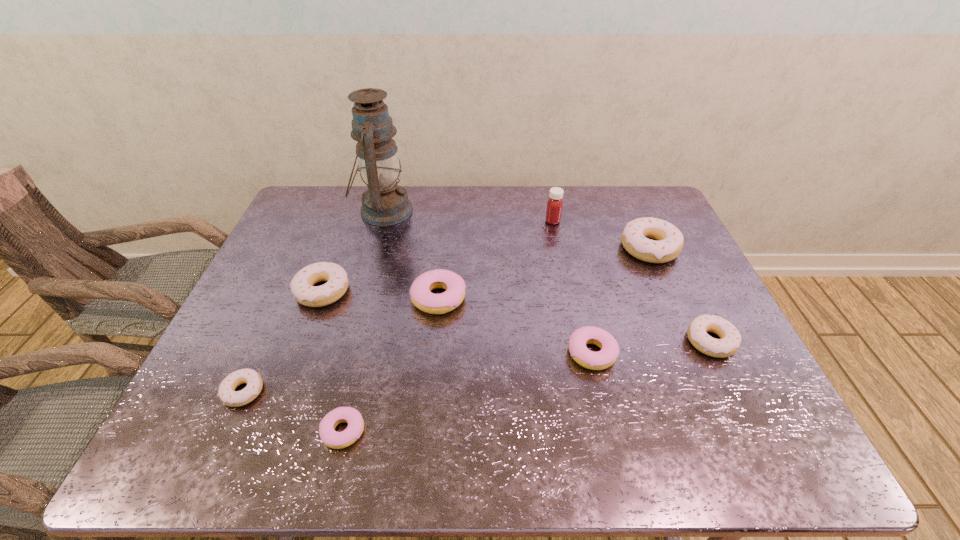
Locate an element on the screen. vacant space at the right edge is located at coordinates (747, 361).

Where is `vacant point at the far left corner`? This screenshot has width=960, height=540. vacant point at the far left corner is located at coordinates (302, 200).

The image size is (960, 540). In the image, there is a desktop. What are the coordinates of `free space at the far right corner` in the screenshot? It's located at (638, 186).

Image resolution: width=960 pixels, height=540 pixels. Identify the location of vacant space at the near right corner of the desktop. (728, 454).

Locate an element on the screen. This screenshot has width=960, height=540. free point between the biggest white doughnut and the farthest pink doughnut is located at coordinates (544, 273).

Locate an element on the screen. empty location between the nearest white doughnut and the third farthest white doughnut is located at coordinates (477, 366).

The image size is (960, 540). Identify the location of free space between the tallest object and the second smallest white doughnut. (547, 276).

What are the coordinates of `unoccupied area between the second nearest object and the second biggest white doughnut` in the screenshot? It's located at (283, 341).

Locate an element on the screen. This screenshot has width=960, height=540. free space between the tallest doughnut and the oil lamp is located at coordinates (516, 230).

Where is `free space that is in between the eighth shortest object and the tallest object`? The width and height of the screenshot is (960, 540). free space that is in between the eighth shortest object and the tallest object is located at coordinates (468, 216).